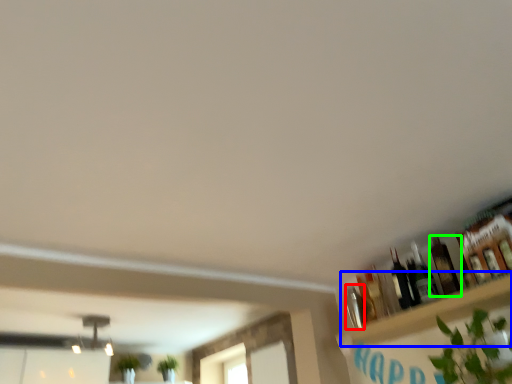
Question: Based on their relative distances, which object is nearer to bottle (highlighted by a red box)? Choose from shelf (highlighted by a blue box) and bottle (highlighted by a green box).

Choices:
 (A) shelf
 (B) bottle

Answer: (A)